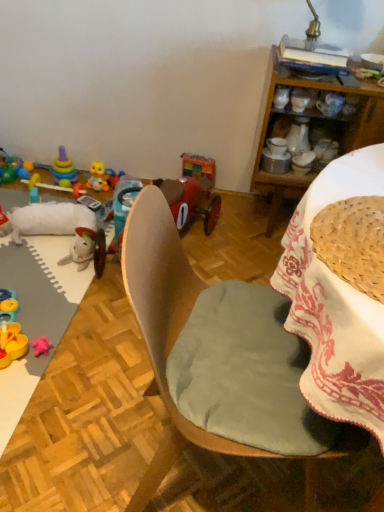
Locate an element on the screen. vacant space in front of rubber duck at lower left, arranged as the third toy when viewed from the right is located at coordinates (15, 393).